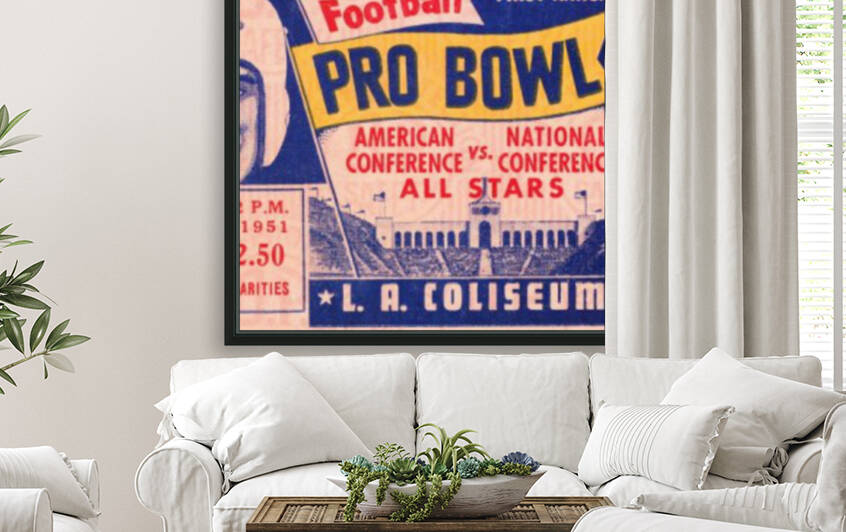
Find the location of a particular element. bowl flower pot is located at coordinates (484, 495).